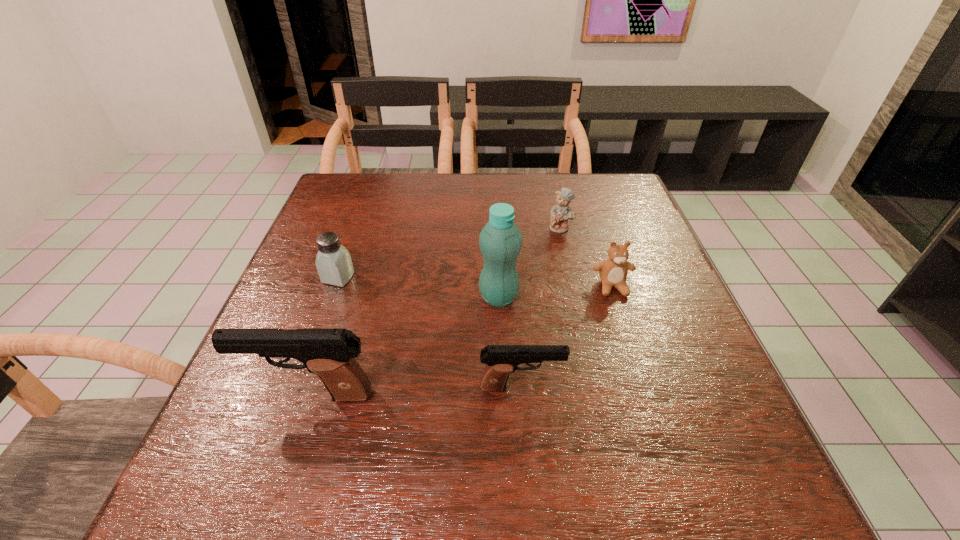
Where is `the second tallest object`? This screenshot has width=960, height=540. the second tallest object is located at coordinates (329, 353).

This screenshot has width=960, height=540. Identify the location of the left pistol. (329, 353).

Find the location of a particular element. This screenshot has width=960, height=540. the right pistol is located at coordinates (501, 360).

Identify the location of the farthest object. (560, 213).

At what (x,y) coordinates should I click in order to perform the action: click on the farther teddy bear. Please return your answer as a coordinate pair (x, y). Looking at the image, I should click on (560, 213).

The width and height of the screenshot is (960, 540). What are the coordinates of `the tallest object` in the screenshot? It's located at (500, 241).

I want to click on saltshaker, so click(x=333, y=262).

Identify the location of the right teddy bear. This screenshot has width=960, height=540. (613, 271).

Locate an element on the screen. The width and height of the screenshot is (960, 540). the nearer teddy bear is located at coordinates (613, 271).

Locate an element on the screen. Image resolution: width=960 pixels, height=540 pixels. vacant point located 0.230m at the barrel of the shorter pistol is located at coordinates (687, 387).